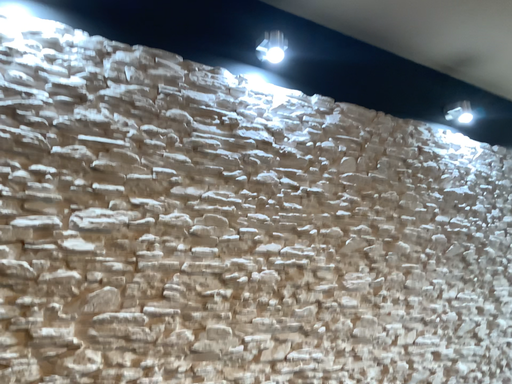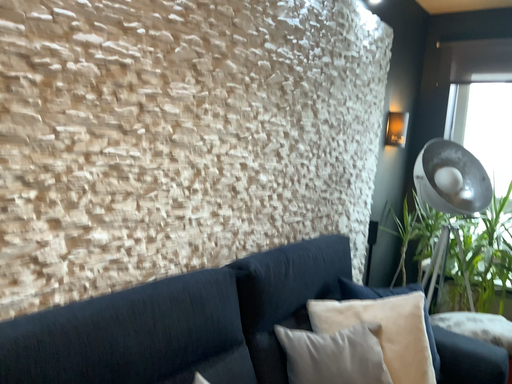
Question: Which way did the camera rotate in the video?

Choices:
 (A) rotated downward
 (B) rotated upward

Answer: (A)